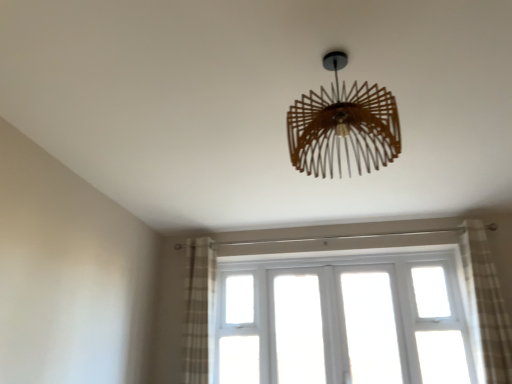
Measure the distance between white wooden window at center and camera.

white wooden window at center and camera are 10.63 feet apart from each other.

The height and width of the screenshot is (384, 512). I want to click on plaid fabric curtain at left, which is counted as the 2th curtain, starting from the right, so click(199, 310).

You are a GUI agent. You are given a task and a screenshot of the screen. Output one action in this format:
    pyautogui.click(x=<x>, y=<y>)
    Task: Click on the plaid fabric curtain at right, the 1th curtain viewed from the right
    This screenshot has width=512, height=384.
    Given the screenshot: What is the action you would take?
    pyautogui.click(x=487, y=302)

The height and width of the screenshot is (384, 512). Find the location of `white wooden window at center`. white wooden window at center is located at coordinates (199, 310).

From the image's perspective, who appears lower, white wooden window at center or wooden chandelier at center?

white wooden window at center appears lower in the image.

Does white wooden window at center appear on the right side of wooden chandelier at center?

Yes.

Is white wooden window at center aimed at wooden chandelier at center?

Yes, white wooden window at center faces towards wooden chandelier at center.

In terms of height, does white wooden window at center look taller or shorter compared to wooden chandelier at center?

white wooden window at center is taller than wooden chandelier at center.

From a real-world perspective, is plaid fabric curtain at right, the 1th curtain viewed from the right, positioned over plaid fabric curtain at left, arranged as the 1th curtain when viewed from the left, based on gravity?

No, from a real-world perspective, plaid fabric curtain at right, the 1th curtain viewed from the right, is not above plaid fabric curtain at left, arranged as the 1th curtain when viewed from the left.

Is plaid fabric curtain at right, the 2th curtain when ordered from left to right, at the right side of plaid fabric curtain at left, arranged as the 1th curtain when viewed from the left?

Correct, you'll find plaid fabric curtain at right, the 2th curtain when ordered from left to right, to the right of plaid fabric curtain at left, arranged as the 1th curtain when viewed from the left.

What's the angular difference between plaid fabric curtain at right, the 2th curtain when ordered from left to right, and plaid fabric curtain at left, which is counted as the 2th curtain, starting from the right,'s facing directions?

The angle between the facing direction of plaid fabric curtain at right, the 2th curtain when ordered from left to right, and the facing direction of plaid fabric curtain at left, which is counted as the 2th curtain, starting from the right, is 1.34 degrees.

Between plaid fabric curtain at right, the 2th curtain when ordered from left to right, and plaid fabric curtain at left, which is counted as the 2th curtain, starting from the right, which one has less height?

Standing shorter between the two is plaid fabric curtain at left, which is counted as the 2th curtain, starting from the right.

Between white wooden window at center and plaid fabric curtain at right, the 1th curtain viewed from the right, which one appears on the right side from the viewer's perspective?

plaid fabric curtain at right, the 1th curtain viewed from the right, is more to the right.

Could you measure the distance between white wooden window at center and plaid fabric curtain at right, the 1th curtain viewed from the right?

6.44 feet.

Is white wooden window at center looking in the opposite direction of plaid fabric curtain at right, the 1th curtain viewed from the right?

white wooden window at center does not have its back to plaid fabric curtain at right, the 1th curtain viewed from the right.

Is plaid fabric curtain at left, arranged as the 1th curtain when viewed from the left, situated inside wooden chandelier at center or outside?

The correct answer is: outside.

Could you tell me if plaid fabric curtain at left, arranged as the 1th curtain when viewed from the left, is facing wooden chandelier at center?

No.

Can you confirm if plaid fabric curtain at left, arranged as the 1th curtain when viewed from the left, is taller than wooden chandelier at center?

Indeed, plaid fabric curtain at left, arranged as the 1th curtain when viewed from the left, has a greater height compared to wooden chandelier at center.

Based on the photo, from the image's perspective, is plaid fabric curtain at right, the 1th curtain viewed from the right, over white wooden window at center?

Correct, plaid fabric curtain at right, the 1th curtain viewed from the right, appears higher than white wooden window at center in the image.

How much distance is there between plaid fabric curtain at right, the 2th curtain when ordered from left to right, and white wooden window at center?

The distance of plaid fabric curtain at right, the 2th curtain when ordered from left to right, from white wooden window at center is 1.96 meters.

Between plaid fabric curtain at right, the 2th curtain when ordered from left to right, and white wooden window at center, which one has more height?

plaid fabric curtain at right, the 2th curtain when ordered from left to right, is taller.

Which of these two, plaid fabric curtain at right, the 2th curtain when ordered from left to right, or white wooden window at center, is wider?

With larger width is plaid fabric curtain at right, the 2th curtain when ordered from left to right.

Is wooden chandelier at center touching plaid fabric curtain at right, the 2th curtain when ordered from left to right?

wooden chandelier at center is not next to plaid fabric curtain at right, the 2th curtain when ordered from left to right, and they're not touching.

Consider the image. Which is further, (395, 143) or (496, 316)?

The point (496, 316) is farther from the camera.

Identify the location of lamp located on the left of plaid fabric curtain at right, the 1th curtain viewed from the right. This screenshot has width=512, height=384. (343, 125).

From the picture: Does wooden chandelier at center have a greater height compared to plaid fabric curtain at right, the 2th curtain when ordered from left to right?

In fact, wooden chandelier at center may be shorter than plaid fabric curtain at right, the 2th curtain when ordered from left to right.

Considering the relative positions of white wooden window at center and plaid fabric curtain at left, arranged as the 1th curtain when viewed from the left, in the image provided, is white wooden window at center to the left of plaid fabric curtain at left, arranged as the 1th curtain when viewed from the left, from the viewer's perspective?

No, white wooden window at center is not to the left of plaid fabric curtain at left, arranged as the 1th curtain when viewed from the left.

From the image's perspective, which is above, white wooden window at center or plaid fabric curtain at left, arranged as the 1th curtain when viewed from the left?

plaid fabric curtain at left, arranged as the 1th curtain when viewed from the left, from the image's perspective.

Which is behind, point (189, 334) or point (189, 328)?

The point (189, 328) is more distant.

From a real-world perspective, between white wooden window at center and plaid fabric curtain at left, arranged as the 1th curtain when viewed from the left, who is vertically lower?

In real-world perspective, white wooden window at center is lower.

The width and height of the screenshot is (512, 384). What are the coordinates of `window behind the wooden chandelier at center` in the screenshot? It's located at (199, 310).

Image resolution: width=512 pixels, height=384 pixels. Find the location of `curtain above the plaid fabric curtain at left, which is counted as the 2th curtain, starting from the right (from the image's perspective)`. curtain above the plaid fabric curtain at left, which is counted as the 2th curtain, starting from the right (from the image's perspective) is located at coordinates (487, 302).

Looking at the image, which one is located closer to plaid fabric curtain at left, arranged as the 1th curtain when viewed from the left, wooden chandelier at center or plaid fabric curtain at right, the 1th curtain viewed from the right?

plaid fabric curtain at right, the 1th curtain viewed from the right, is closer to plaid fabric curtain at left, arranged as the 1th curtain when viewed from the left.

Estimate the real-world distances between objects in this image. Which object is further from plaid fabric curtain at right, the 2th curtain when ordered from left to right, white wooden window at center or plaid fabric curtain at left, which is counted as the 2th curtain, starting from the right?

The object further to plaid fabric curtain at right, the 2th curtain when ordered from left to right, is plaid fabric curtain at left, which is counted as the 2th curtain, starting from the right.

From the image, which object appears to be farther from wooden chandelier at center, plaid fabric curtain at left, which is counted as the 2th curtain, starting from the right, or white wooden window at center?

white wooden window at center is further to wooden chandelier at center.

When comparing their distances from plaid fabric curtain at right, the 1th curtain viewed from the right, does plaid fabric curtain at left, which is counted as the 2th curtain, starting from the right, or wooden chandelier at center seem closer?

Based on the image, wooden chandelier at center appears to be nearer to plaid fabric curtain at right, the 1th curtain viewed from the right.

Based on their spatial positions, is wooden chandelier at center or plaid fabric curtain at left, which is counted as the 2th curtain, starting from the right, closer to white wooden window at center?

The object closer to white wooden window at center is plaid fabric curtain at left, which is counted as the 2th curtain, starting from the right.

Estimate the real-world distances between objects in this image. Which object is further from plaid fabric curtain at left, which is counted as the 2th curtain, starting from the right, white wooden window at center or plaid fabric curtain at right, the 1th curtain viewed from the right?

plaid fabric curtain at right, the 1th curtain viewed from the right, is positioned further to the anchor plaid fabric curtain at left, which is counted as the 2th curtain, starting from the right.

Which object lies further to the anchor point plaid fabric curtain at right, the 1th curtain viewed from the right, plaid fabric curtain at left, which is counted as the 2th curtain, starting from the right, or white wooden window at center?

plaid fabric curtain at left, which is counted as the 2th curtain, starting from the right, is further to plaid fabric curtain at right, the 1th curtain viewed from the right.

Considering their positions, is wooden chandelier at center positioned further to white wooden window at center than plaid fabric curtain at right, the 2th curtain when ordered from left to right?

The object further to white wooden window at center is wooden chandelier at center.

Where is `lamp located between plaid fabric curtain at left, which is counted as the 2th curtain, starting from the right, and plaid fabric curtain at right, the 2th curtain when ordered from left to right, in the left-right direction`? This screenshot has width=512, height=384. lamp located between plaid fabric curtain at left, which is counted as the 2th curtain, starting from the right, and plaid fabric curtain at right, the 2th curtain when ordered from left to right, in the left-right direction is located at coordinates (343, 125).

Identify the location of window situated between plaid fabric curtain at left, arranged as the 1th curtain when viewed from the left, and plaid fabric curtain at right, the 1th curtain viewed from the right, from left to right. The image size is (512, 384). (199, 310).